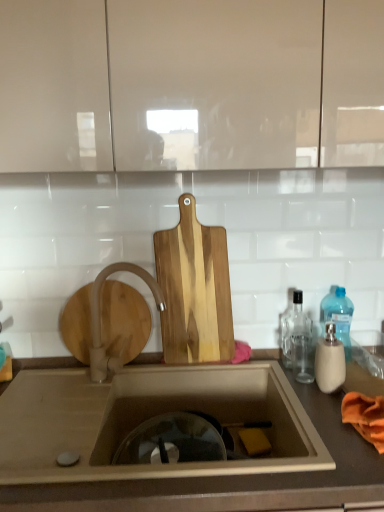
You are a GUI agent. You are given a task and a screenshot of the screen. Output one action in this format:
    pyautogui.click(x=<x>, y=<y>)
    Task: Click on the vacant space positioned to the left of white matte faucet at sink left
    The width and height of the screenshot is (384, 512).
    Given the screenshot: What is the action you would take?
    pyautogui.click(x=66, y=389)